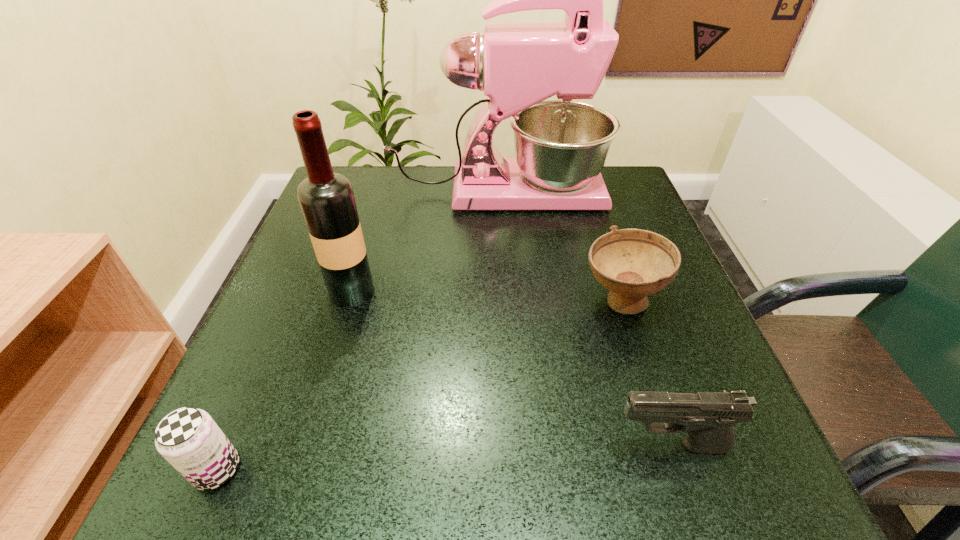
Find the location of `free space between the farthest object and the wine bottle`. free space between the farthest object and the wine bottle is located at coordinates (424, 242).

Where is `the second closest object relative to the fourth shortest object`? the second closest object relative to the fourth shortest object is located at coordinates (189, 439).

This screenshot has width=960, height=540. I want to click on the closest object to the pistol, so click(632, 263).

You are a GUI agent. You are given a task and a screenshot of the screen. Output one action in this format:
    pyautogui.click(x=<x>, y=<y>)
    Task: Click on the free space in the image that satisfies the following two spatial constraints: 1. on the back side of the second tallest object; 2. on the right side of the beer can
    The height and width of the screenshot is (540, 960).
    Given the screenshot: What is the action you would take?
    pyautogui.click(x=295, y=291)

Where is `vacant position in the image that satisfies the following two spatial constraints: 1. on the back side of the second tallest object; 2. on the left side of the beer can`? vacant position in the image that satisfies the following two spatial constraints: 1. on the back side of the second tallest object; 2. on the left side of the beer can is located at coordinates (295, 291).